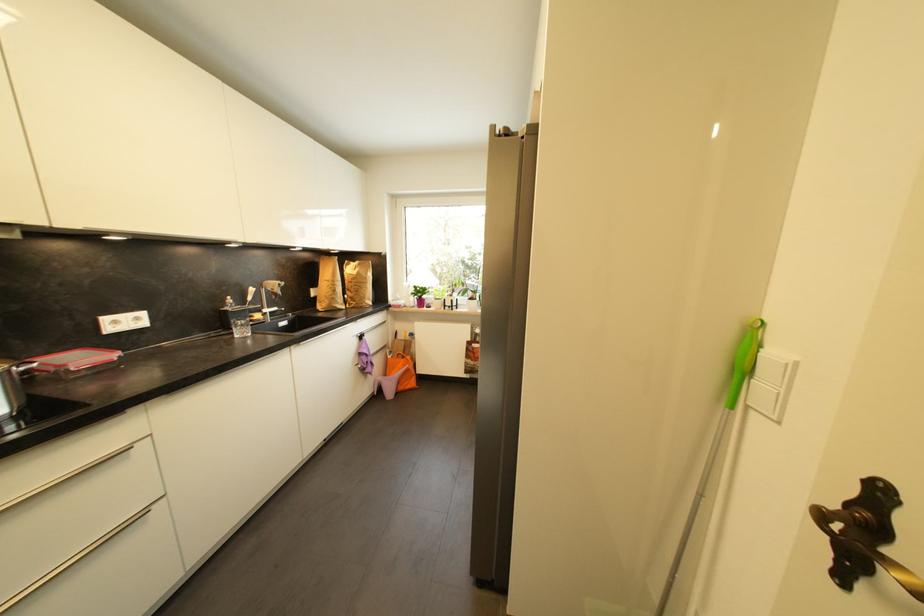
The image size is (924, 616). In order to click on green mop handle in this screenshot , I will do `click(744, 361)`.